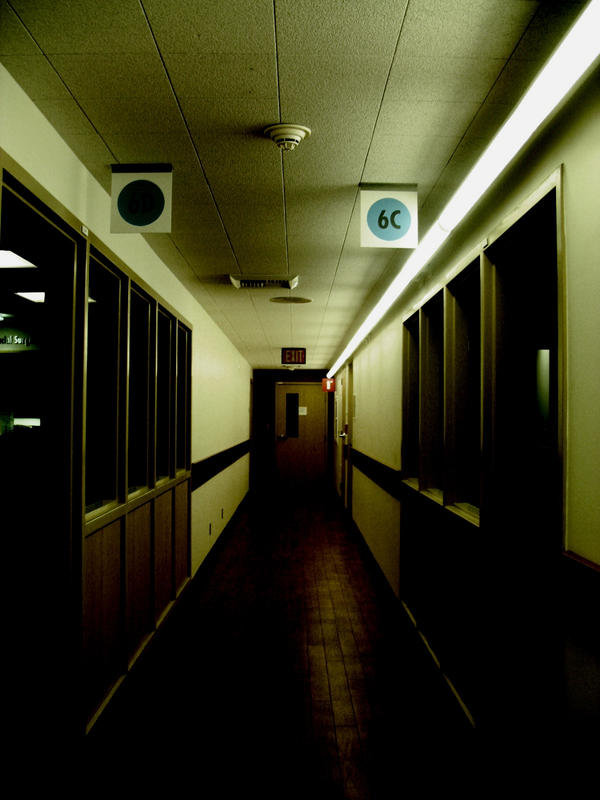
Where is `window`? window is located at coordinates (106, 426).